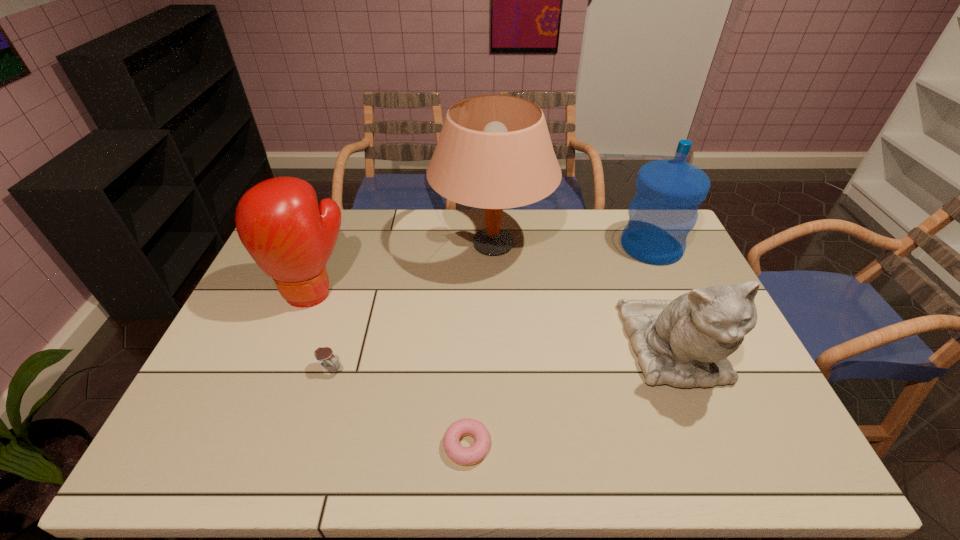
Locate an element on the screen. This screenshot has width=960, height=540. vacant region between the fifth tallest object and the cat is located at coordinates (502, 359).

Find the location of `vacant area between the boxing glove and the water jug`. vacant area between the boxing glove and the water jug is located at coordinates (482, 269).

The width and height of the screenshot is (960, 540). Identify the location of free space between the nearest object and the water jug. (560, 346).

You are a GUI agent. You are given a task and a screenshot of the screen. Output one action in this format:
    pyautogui.click(x=<x>, y=<y>)
    Task: Click on the free area in between the water jug and the cat
    This screenshot has height=540, width=960.
    Given the screenshot: What is the action you would take?
    pyautogui.click(x=662, y=298)

Image resolution: width=960 pixels, height=540 pixels. What are the coordinates of `free area in between the lampshade and the watch` in the screenshot? It's located at (411, 307).

Select which object is the fifth closest to the boxing glove. Please provide its 2D coordinates. Your answer should be formatted as a tuple, i.e. [(x, y)], where the tuple contains the x and y coordinates of a point satisfying the conditions above.

[(663, 211)]

The image size is (960, 540). Identify the location of the closest object to the water jug. (x=685, y=342).

You are a GUI agent. You are given a task and a screenshot of the screen. Output one action in this format:
    pyautogui.click(x=<x>, y=<y>)
    Task: Click on the vacant space that satisfies the following two spatial constraints: 1. on the front-facing side of the tallest object; 2. on the striking surface of the boxing glove
    
    Given the screenshot: What is the action you would take?
    pyautogui.click(x=493, y=291)

This screenshot has height=540, width=960. I want to click on vacant point that satisfies the following two spatial constraints: 1. on the front-facing side of the tallest object; 2. on the front side of the nearest object, so click(x=498, y=446).

The image size is (960, 540). Identify the location of vacant space that satisfies the following two spatial constraints: 1. on the front-facing side of the water jug; 2. on the right side of the lampshade. (492, 246).